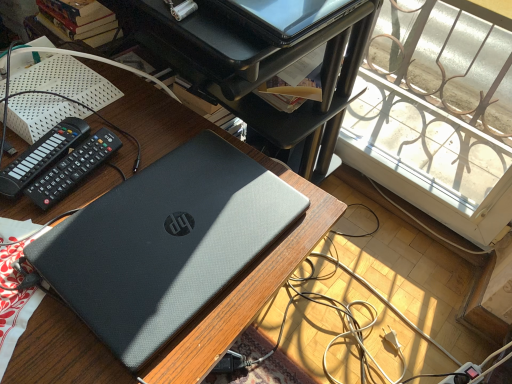
Question: Is black plastic remote at left, which ranks as the 2th control in right-to-left order, in front of or behind black plastic remote at upper left, the 2th control when ordered from left to right, in the image?

Choices:
 (A) behind
 (B) front

Answer: (A)

Question: Does point (12, 193) appear closer or farther from the camera than point (105, 145)?

Choices:
 (A) farther
 (B) closer

Answer: (B)

Question: Estimate the real-world distances between objects in this image. Which object is closer to the black plastic remote at upper left, the 2th control when ordered from left to right?

Choices:
 (A) sleek black laptop at upper center
 (B) black plastic remote at left, which appears as the 1th control when viewed from the left
 (C) matte black laptop at center

Answer: (B)

Question: Estimate the real-world distances between objects in this image. Which object is closer to the matte black laptop at center?

Choices:
 (A) sleek black laptop at upper center
 (B) black plastic remote at left, which appears as the 1th control when viewed from the left
 (C) black plastic remote at upper left, the 2th control when ordered from left to right

Answer: (C)